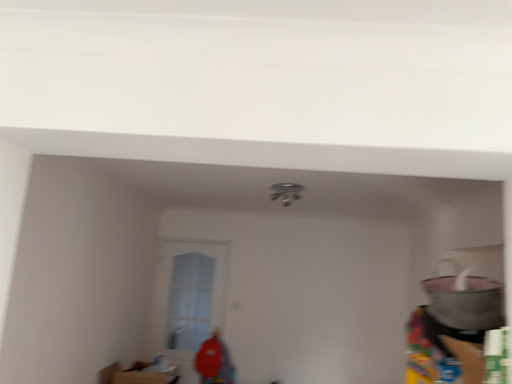
This screenshot has height=384, width=512. What do you see at coordinates (465, 300) in the screenshot? I see `matte gray pot at right` at bounding box center [465, 300].

What is the approximate width of matte gray pot at right?

30.66 centimeters.

What are the coordinates of `matte gray pot at right` in the screenshot? It's located at (465, 300).

The width and height of the screenshot is (512, 384). What do you see at coordinates (189, 301) in the screenshot?
I see `clear glass door at center` at bounding box center [189, 301].

You are a GUI agent. You are given a task and a screenshot of the screen. Output one action in this format:
    pyautogui.click(x=<x>, y=<y>)
    Task: Click on the clear glass door at center
    The width and height of the screenshot is (512, 384).
    Given the screenshot: What is the action you would take?
    pyautogui.click(x=189, y=301)

Identify the location of matte gray pot at right. [x=465, y=300].

Considering the relative positions of clear glass door at center and matte gray pot at right in the image provided, is clear glass door at center to the left of matte gray pot at right from the viewer's perspective?

Indeed, clear glass door at center is positioned on the left side of matte gray pot at right.

Which object is closer to the camera taking this photo, clear glass door at center or matte gray pot at right?

matte gray pot at right is in front.

Is point (174, 336) less distant than point (476, 328)?

No, (174, 336) is further to viewer.

From the image's perspective, who appears lower, clear glass door at center or matte gray pot at right?

clear glass door at center.

From a real-world perspective, is clear glass door at center positioned above or below matte gray pot at right?

In terms of real-world spatial position, clear glass door at center is below matte gray pot at right.

Is clear glass door at center wider or thinner than matte gray pot at right?

Considering their sizes, clear glass door at center looks slimmer than matte gray pot at right.

Considering the sizes of objects clear glass door at center and matte gray pot at right in the image provided, who is shorter, clear glass door at center or matte gray pot at right?

Standing shorter between the two is matte gray pot at right.

Who is smaller, clear glass door at center or matte gray pot at right?

Smaller between the two is clear glass door at center.

Choose the correct answer: Is clear glass door at center inside matte gray pot at right or outside it?

clear glass door at center exists outside the volume of matte gray pot at right.

Are clear glass door at center and matte gray pot at right far apart?

That's right, there is a large distance between clear glass door at center and matte gray pot at right.

Could you tell me if clear glass door at center is facing matte gray pot at right?

No, clear glass door at center is not aimed at matte gray pot at right.

Image resolution: width=512 pixels, height=384 pixels. What are the coordinates of `appliance that appears on the right of clear glass door at center` in the screenshot? It's located at (465, 300).

Is matte gray pot at right to the left of clear glass door at center from the viewer's perspective?

Incorrect, matte gray pot at right is not on the left side of clear glass door at center.

Considering their positions, is matte gray pot at right located in front of or behind clear glass door at center?

In the image, matte gray pot at right appears in front of clear glass door at center.

Does point (476, 329) come closer to viewer compared to point (186, 338)?

Yes, point (476, 329) is closer to viewer.

From the image's perspective, who appears lower, matte gray pot at right or clear glass door at center?

clear glass door at center, from the image's perspective.

From a real-world perspective, is matte gray pot at right beneath clear glass door at center?

No.

Considering the relative sizes of matte gray pot at right and clear glass door at center in the image provided, is matte gray pot at right wider than clear glass door at center?

Correct, the width of matte gray pot at right exceeds that of clear glass door at center.

Between matte gray pot at right and clear glass door at center, which one has less height?

matte gray pot at right.

Who is bigger, matte gray pot at right or clear glass door at center?

Bigger between the two is matte gray pot at right.

Is matte gray pot at right not within clear glass door at center?

Indeed, matte gray pot at right is completely outside clear glass door at center.

Is matte gray pot at right positioned far away from clear glass door at center?

That's right, there is a large distance between matte gray pot at right and clear glass door at center.

Is matte gray pot at right turned away from clear glass door at center?

That's not correct — matte gray pot at right is not looking away from clear glass door at center.

You are a GUI agent. You are given a task and a screenshot of the screen. Output one action in this format:
    pyautogui.click(x=<x>, y=<y>)
    Task: Click on the glass door behind the matte gray pot at right
    
    Given the screenshot: What is the action you would take?
    [189, 301]

I want to click on appliance located above the clear glass door at center (from a real-world perspective), so click(x=465, y=300).

I want to click on glass door that is under the matte gray pot at right (from a real-world perspective), so click(189, 301).